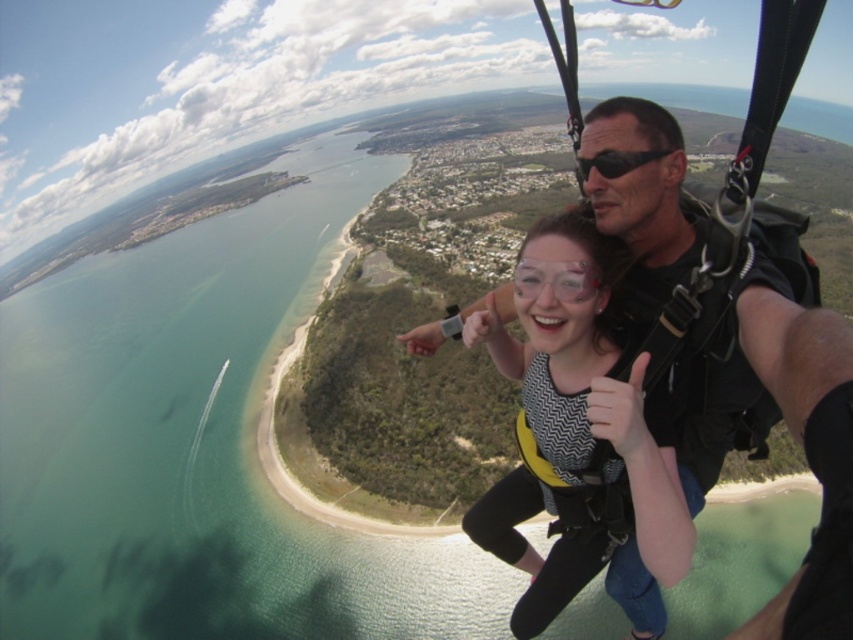
You are a safety inspector reviewing the tandem skydiving gear. You need to ensure that the distance between the matte black harness at center and the black matte goggles at upper center meets the safety standard of 30 meters. Is the current distance compliant?

The matte black harness at center and black matte goggles at upper center are 29.85 meters apart, which is slightly less than the required 30 meters. Therefore, the current distance does not meet the safety standard.

What are the coordinates of the matte black harness at center?

The matte black harness at center is located at coordinates point (573, 422).

You are the student in the skydiving scene. You notice two harnesses in front of you. Which harness is closer to you, the matte black harness at center or the yellow fabric harness at center?

The matte black harness at center is closer to you because the yellow fabric harness at center is positioned behind it.